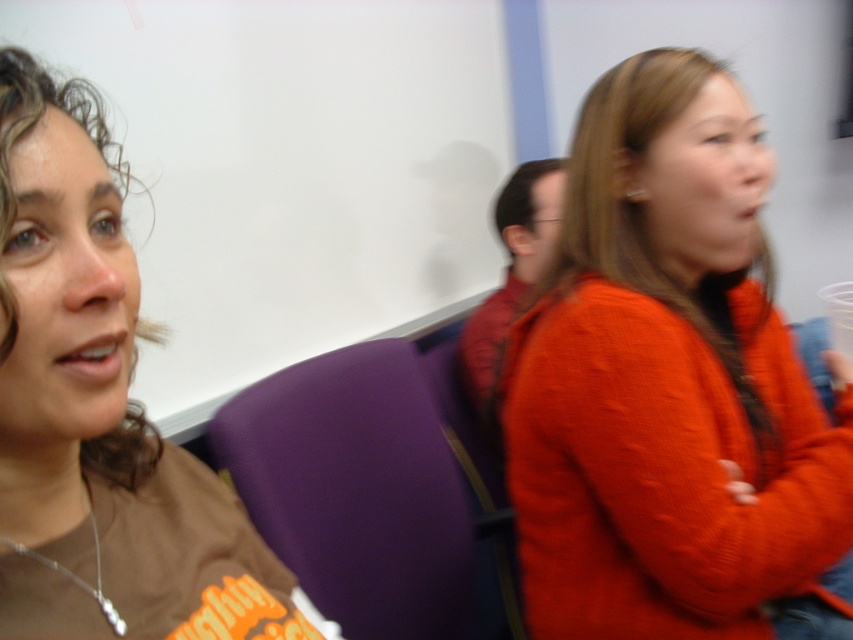
You are organizing a seating arrangement for a workshop and need to ensure there is enough space between the orange knitted sweater at right and the purple fabric chair at center. Based on their sizes, do you think they can be placed side by side without overlapping?

The orange knitted sweater at right might be wider than the purple fabric chair at center, so there is a possibility they could overlap if placed side by side. Ensure there is sufficient space between them to avoid overlapping.

You are organizing a seating arrangement for a workshop and need to know the spatial relationship between the orange knitted sweater at right and the brown cotton shirt at left. Which object is located to the right of the other?

The orange knitted sweater at right is positioned over brown cotton shirt at left, meaning it is located to the right of the brown cotton shirt at left.

You are sitting in the purple fabric chair at center and want to hand your beverage to the person wearing the orange knitted sweater at right. Which direction should you pass the beverage?

You should pass the beverage to the right, as the orange knitted sweater at right is located to the right of the purple fabric chair at center.